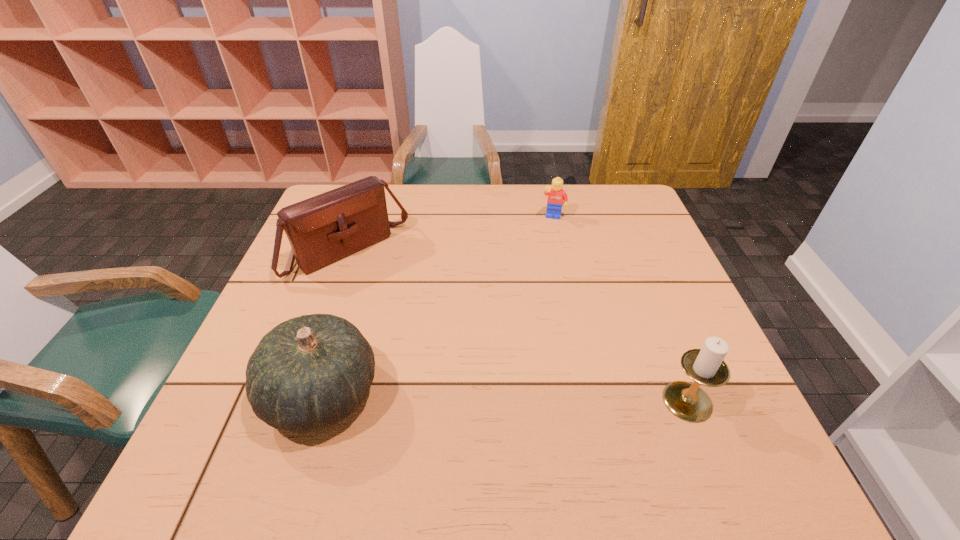
Locate an element on the screen. vacant space on the desktop that is between the gourd and the rightmost object and is positioned on the face of the farthest object is located at coordinates (528, 398).

Where is `vacant space on the desktop that is between the gourd and the rightmost object and is positioned on the front flap of the shoulder bag`? The image size is (960, 540). vacant space on the desktop that is between the gourd and the rightmost object and is positioned on the front flap of the shoulder bag is located at coordinates (504, 397).